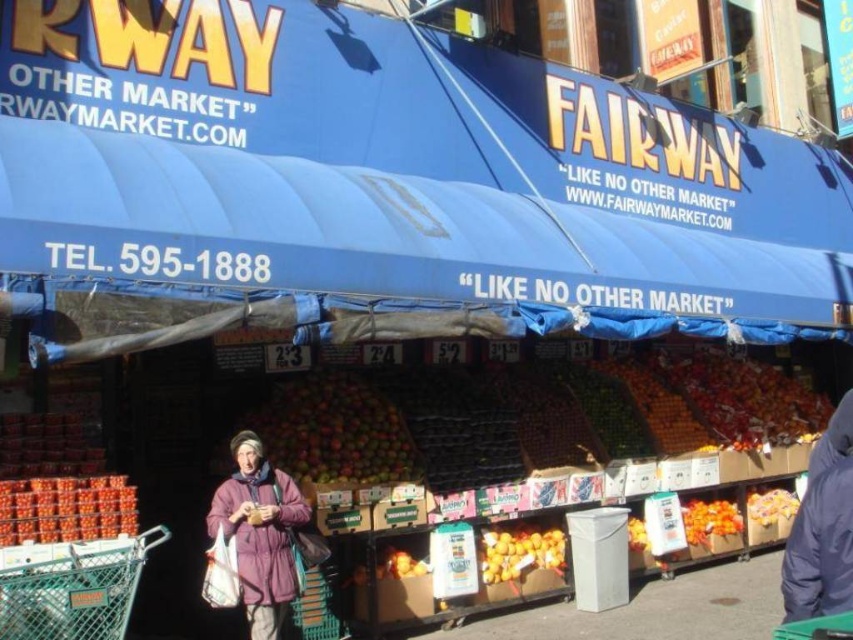
Which of these two, dark blue puffy coat at lower right or orange matte fruit at center, stands shorter?

dark blue puffy coat at lower right

From the picture: Which is below, dark blue puffy coat at lower right or orange matte fruit at center?

Positioned lower is orange matte fruit at center.

Between point (846, 506) and point (555, 528), which one is positioned behind?

The point (555, 528) is behind.

The image size is (853, 640). I want to click on dark blue puffy coat at lower right, so click(x=822, y=528).

Does green wire shopping cart at lower left appear on the left side of orange matte fruit at center?

Indeed, green wire shopping cart at lower left is positioned on the left side of orange matte fruit at center.

Can you confirm if green wire shopping cart at lower left is positioned above orange matte fruit at center?

Yes, green wire shopping cart at lower left is above orange matte fruit at center.

Does point (161, 536) lie behind point (482, 554)?

No, it is in front of (482, 554).

Find the location of a particular element. This screenshot has height=640, width=853. green wire shopping cart at lower left is located at coordinates (74, 592).

Is point (347, 404) positioned in front of point (518, 552)?

Yes, point (347, 404) is in front of point (518, 552).

Is shiny red apples at center below orange matte fruit at center?

No.

You are a GUI agent. You are given a task and a screenshot of the screen. Output one action in this format:
    pyautogui.click(x=<x>, y=<y>)
    Task: Click on the shiny red apples at center
    The image size is (853, 640).
    Given the screenshot: What is the action you would take?
    pyautogui.click(x=335, y=432)

Find the location of a particular element. The width and height of the screenshot is (853, 640). shiny red apples at center is located at coordinates (335, 432).